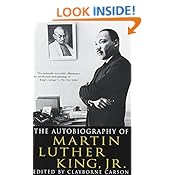
Where is `desk`? This screenshot has height=175, width=175. desk is located at coordinates (51, 124).